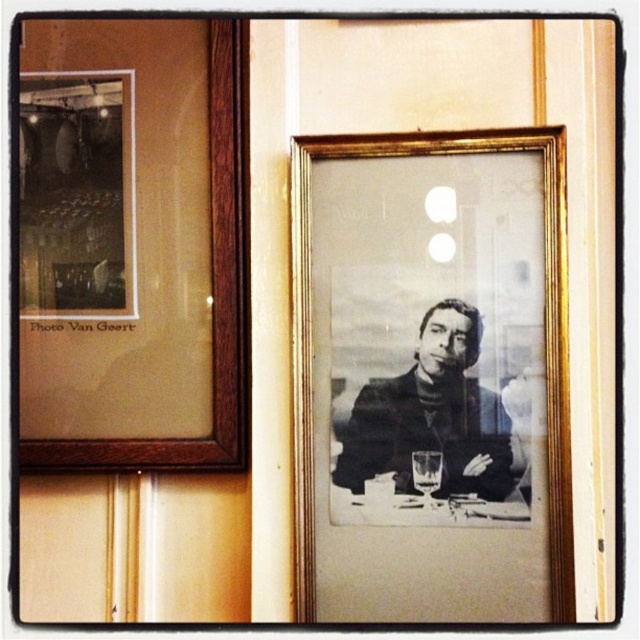
You are an interior designer arranging furniture in a room with the wooden photo frame at left and the black matte portrait at center. You want to place a new shelf behind both. Which object should the shelf be placed behind to avoid blocking either?

The shelf should be placed behind the wooden photo frame at left because it is in front of the black matte portrait at center, so placing the shelf behind the wooden photo frame at left would ensure it doesn not block the black matte portrait at center.

You are hanging a new picture on the wall between the gold metallic picture frame at center and the wooden photo frame at left. Which existing frame should you place it closer to if you want it to be positioned exactly in the middle between them?

You should place the new picture closer to the wooden photo frame at left because the gold metallic picture frame at center is already to the right of the wooden photo frame at left, so the midpoint would be closer to the left frame.

You are an interior designer arranging furniture in a living room. You have a small shelf that can only hold items up to 30 cm in width. You see the gold metallic picture frame at center and the wooden photo frame at left. Which one can you place on the shelf without exceeding the width limit?

The wooden photo frame at left can be placed on the shelf since its width is smaller than the gold metallic picture frame at center, which exceeds the 30 cm limit.